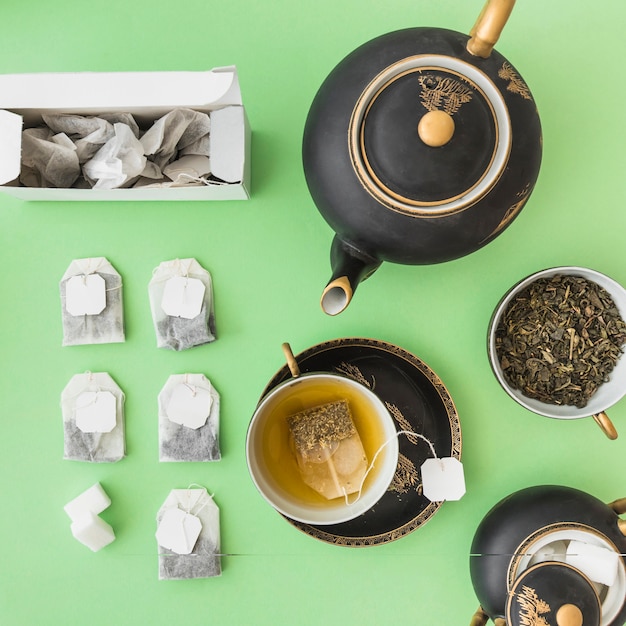
Locate an element on the screen. Image resolution: width=626 pixels, height=626 pixels. sugar pot lid is located at coordinates (560, 587).